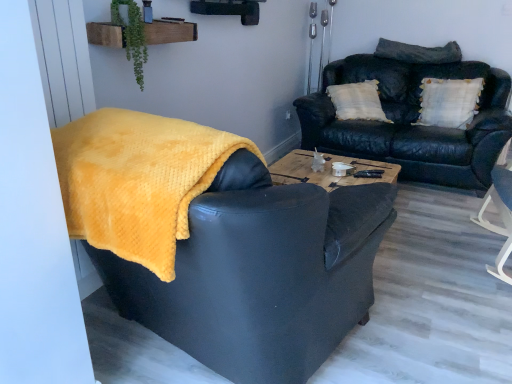
Question: From a real-world perspective, does leather couch at upper right stand above yellow fuzzy blanket at left?

Choices:
 (A) no
 (B) yes

Answer: (A)

Question: Does leather couch at upper right lie in front of yellow fuzzy blanket at left?

Choices:
 (A) yes
 (B) no

Answer: (B)

Question: Can you confirm if leather couch at upper right is smaller than yellow fuzzy blanket at left?

Choices:
 (A) no
 (B) yes

Answer: (A)

Question: Can you confirm if leather couch at upper right is taller than yellow fuzzy blanket at left?

Choices:
 (A) no
 (B) yes

Answer: (A)

Question: From the image's perspective, would you say leather couch at upper right is positioned over yellow fuzzy blanket at left?

Choices:
 (A) yes
 (B) no

Answer: (A)

Question: Is leather couch at upper right not inside yellow fuzzy blanket at left?

Choices:
 (A) yes
 (B) no

Answer: (A)

Question: Is dark gray textured pillow at upper right, the first pillow when ordered from top to bottom, at the back of green leafy plant at upper center?

Choices:
 (A) yes
 (B) no

Answer: (B)

Question: Is green leafy plant at upper center oriented towards dark gray textured pillow at upper right, placed as the 2th pillow when sorted from bottom to top?

Choices:
 (A) yes
 (B) no

Answer: (B)

Question: Is green leafy plant at upper center thinner than dark gray textured pillow at upper right, placed as the 2th pillow when sorted from bottom to top?

Choices:
 (A) no
 (B) yes

Answer: (B)

Question: Can you confirm if green leafy plant at upper center is bigger than dark gray textured pillow at upper right, the first pillow when ordered from top to bottom?

Choices:
 (A) no
 (B) yes

Answer: (A)

Question: Can you confirm if green leafy plant at upper center is smaller than dark gray textured pillow at upper right, the first pillow when ordered from top to bottom?

Choices:
 (A) no
 (B) yes

Answer: (B)

Question: Is green leafy plant at upper center at the left side of dark gray textured pillow at upper right, placed as the 2th pillow when sorted from bottom to top?

Choices:
 (A) yes
 (B) no

Answer: (A)

Question: From a real-world perspective, is green leafy plant at upper center positioned under leather couch at upper right based on gravity?

Choices:
 (A) yes
 (B) no

Answer: (B)